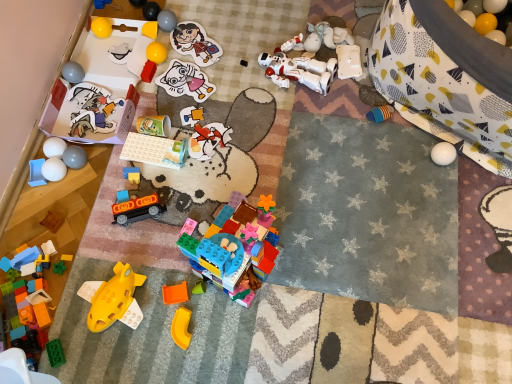
I want to click on blank space to the left of white matte robot at upper center, positioned as the 23th toy in left-to-right order, so click(x=233, y=72).